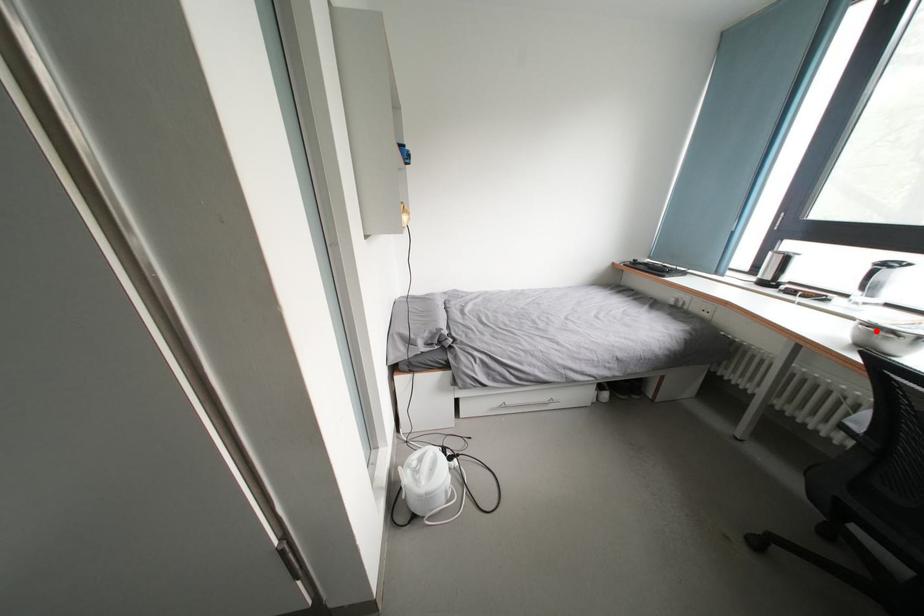
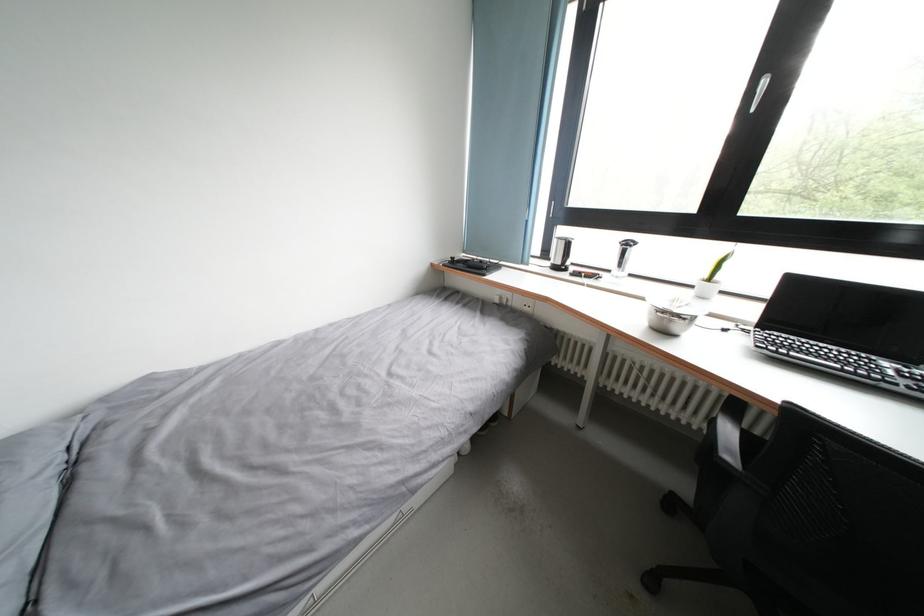
Question: I am providing you with two images of the same scene from different viewpoints. A red point is marked on the first image. Can you still see the location of the red point in image 2?

Choices:
 (A) Yes
 (B) No

Answer: (A)